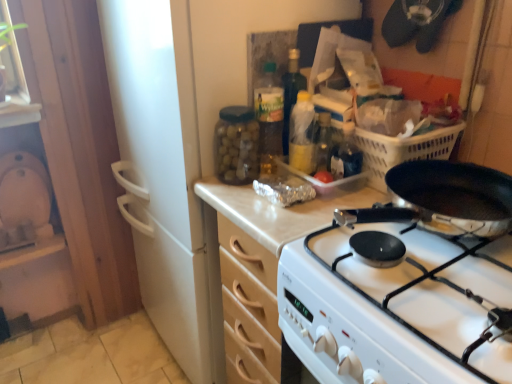
The width and height of the screenshot is (512, 384). I want to click on vacant area that is in front of translucent plastic bottle at center, acting as the third bottle starting from the left, so click(295, 213).